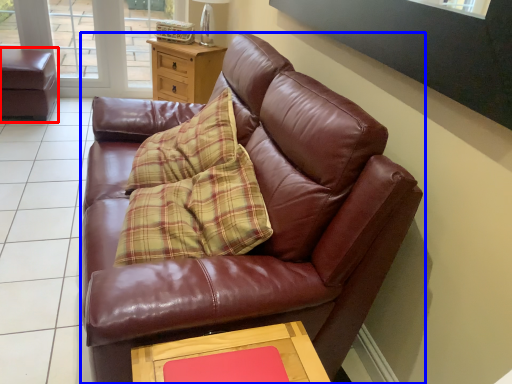
Question: Which point is further to the camera, swivel chair (highlighted by a red box) or studio couch (highlighted by a blue box)?

Choices:
 (A) swivel chair
 (B) studio couch

Answer: (A)